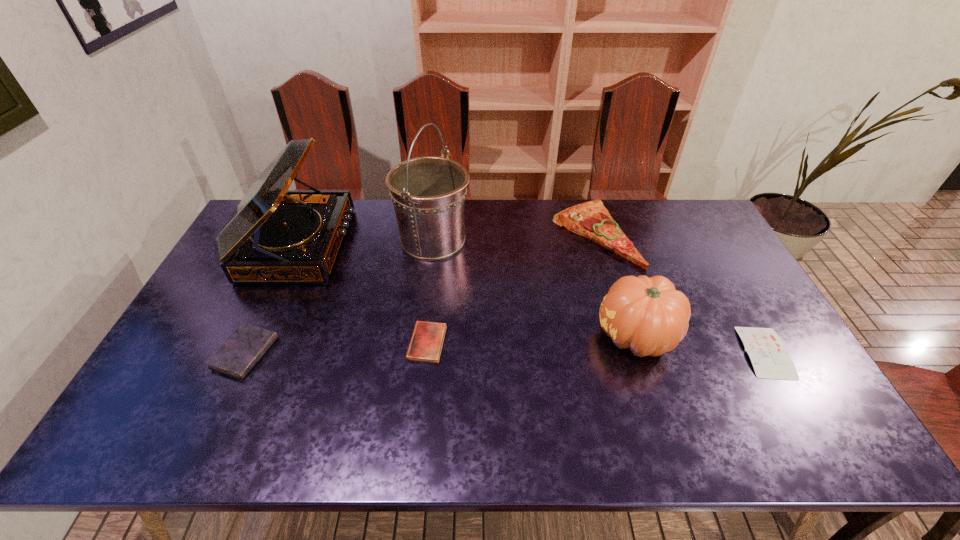
The image size is (960, 540). Identify the location of record player that is at the far edge. (274, 236).

You are a GUI agent. You are given a task and a screenshot of the screen. Output one action in this format:
    pyautogui.click(x=<x>, y=<y>)
    Task: Click on the pizza that is positioned at the far edge
    This screenshot has width=960, height=540.
    Given the screenshot: What is the action you would take?
    pyautogui.click(x=591, y=219)

Locate an element on the screen. This screenshot has height=540, width=960. record player that is at the left edge is located at coordinates (274, 236).

What are the coordinates of `diary at the left edge` in the screenshot? It's located at (241, 351).

The image size is (960, 540). Find the location of `object present at the right edge`. object present at the right edge is located at coordinates (768, 355).

The image size is (960, 540). Find the location of `object located at the far left corner`. object located at the far left corner is located at coordinates (274, 236).

Where is `vacant space at the far edge of the desktop`? The height and width of the screenshot is (540, 960). vacant space at the far edge of the desktop is located at coordinates (515, 201).

I want to click on free space at the near edge of the desktop, so click(353, 435).

This screenshot has width=960, height=540. In order to click on vacant space at the left edge of the desktop in this screenshot , I will do `click(217, 302)`.

In the image, there is a desktop. Find the location of `vacant area at the right edge`. vacant area at the right edge is located at coordinates (802, 389).